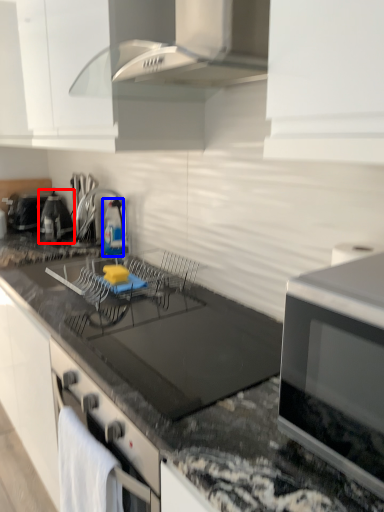
Question: Which of the following is the closest to the observer, appliance (highlighted by a red box) or bottle (highlighted by a blue box)?

Choices:
 (A) appliance
 (B) bottle

Answer: (B)